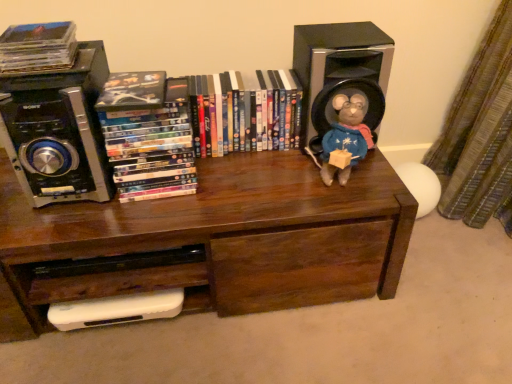
At what (x,y) coordinates should I click in order to perform the action: click on space that is in front of black plastic speaker at upper right, arranged as the second speaker when viewed from the left. Please return your answer as a coordinate pair (x, y). The image size is (512, 384). Looking at the image, I should click on (330, 180).